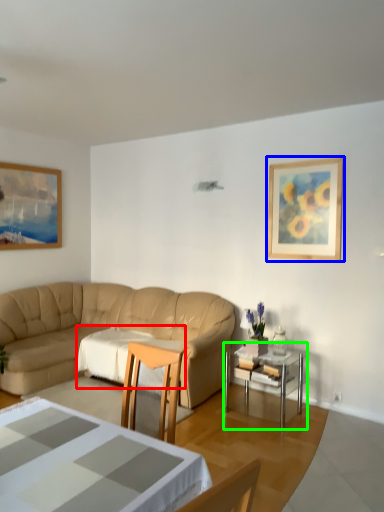
Question: Which object is the farthest from tablecloth (highlighted by a red box)? Choose among these: picture frame (highlighted by a blue box) or table (highlighted by a green box).

Choices:
 (A) picture frame
 (B) table

Answer: (A)